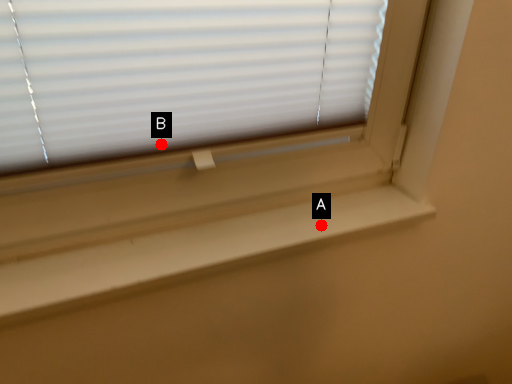
Question: Two points are circled on the image, labeled by A and B beside each circle. Which of the following is the farthest from the observer?

Choices:
 (A) A is further
 (B) B is further

Answer: (A)